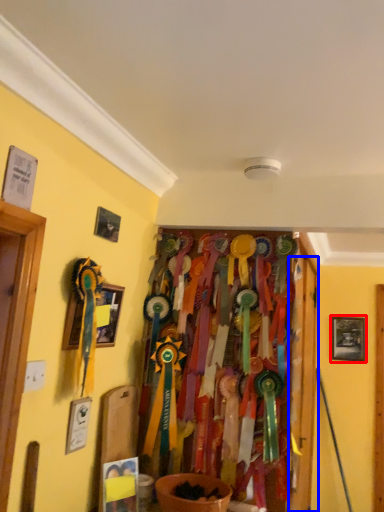
Question: Which of the following is the closest to the observer, picture frame (highlighted by a red box) or door (highlighted by a blue box)?

Choices:
 (A) picture frame
 (B) door

Answer: (B)